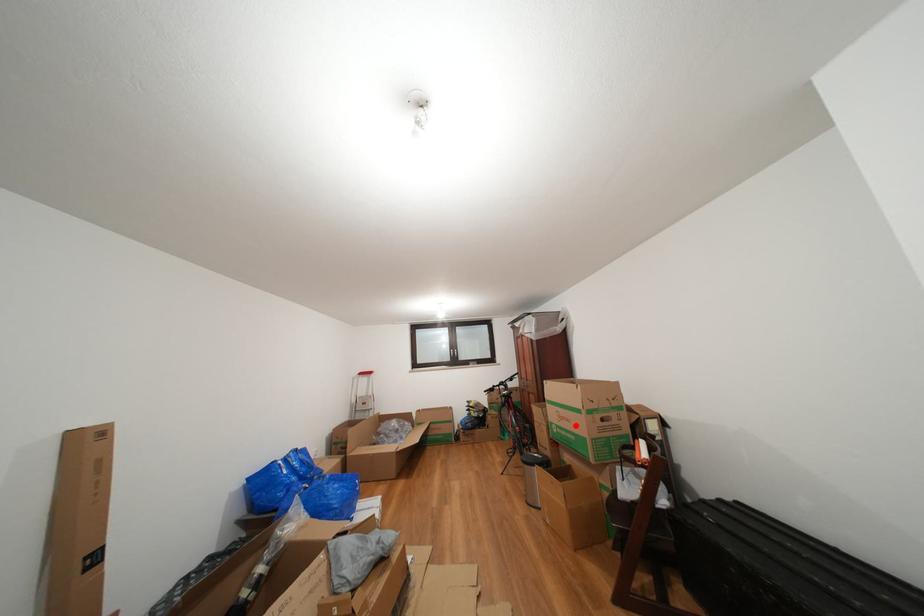
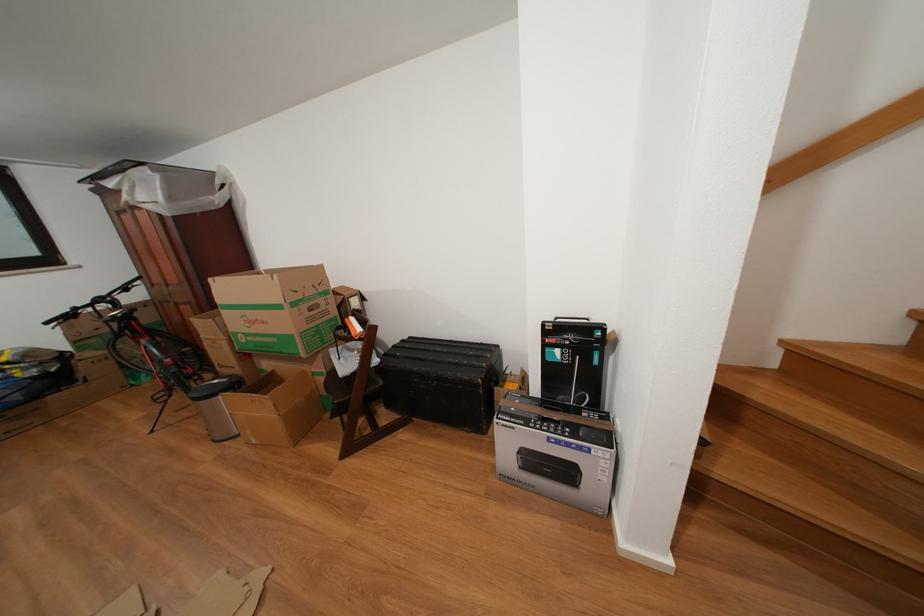
Question: I am providing you with two images of the same scene from different viewpoints. Given a red point in image1, look at the same physical point in image2. Is it:

Choices:
 (A) Closer to the viewpoint
 (B) Farther from the viewpoint

Answer: (A)